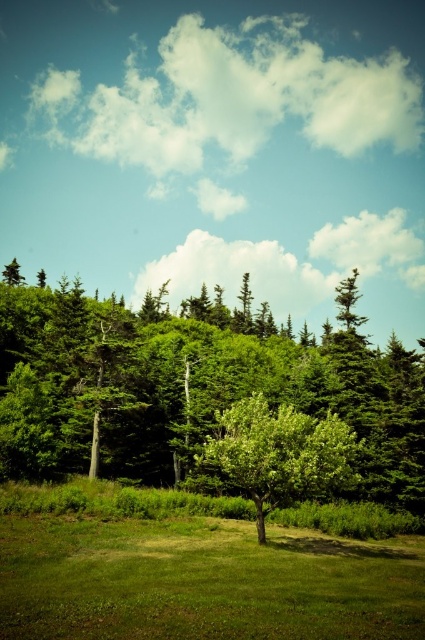
You are a hiker standing in the middle of the grassy area. You notice the green leafy trees at center and the green grass at center. Which one is taller?

The green leafy trees at center are taller than the green grass at center.

You are standing in the forest and see the green leafy trees at center and the green leafy tree at center. Which one is closer to you?

The green leafy tree at center is closer to you because it is positioned in front of the green leafy trees at center.

You are planning to place a picnic blanket in the grassy area of the scene. Given that the green grass at center is wider than the green leafy tree at center, where should you position the blanket to ensure it fits entirely within the grassy area?

The green grass at center is wider than the green leafy tree at center, so positioning the picnic blanket within the green grass at center ensures it fits entirely within the grassy area.